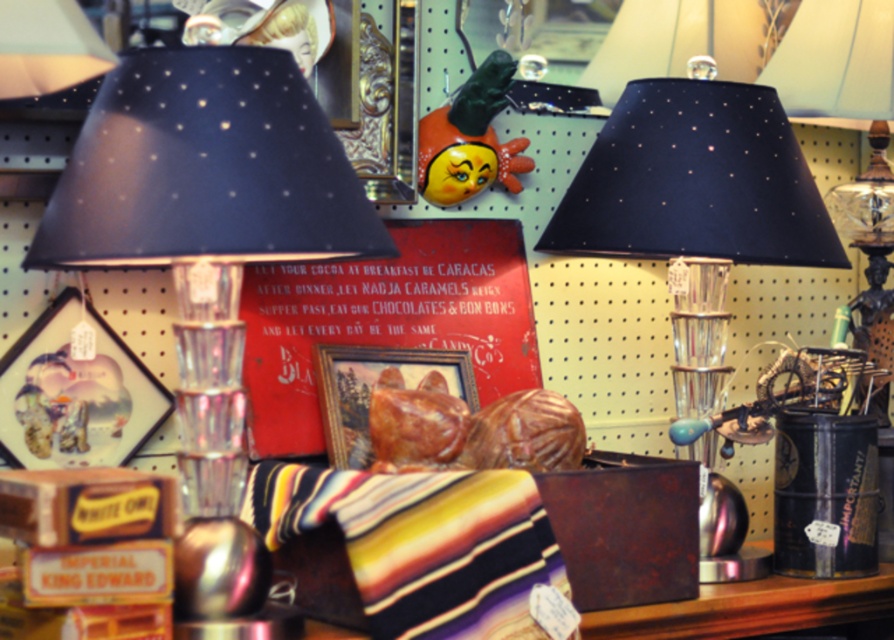
Question: Which point is farther to the camera?

Choices:
 (A) matte black lampshade at upper center
 (B) matte black lampshade at center
 (C) red cardboard sign at center

Answer: (A)

Question: Which object appears farthest from the camera in this image?

Choices:
 (A) matte glass lamp at left
 (B) matte black lampshade at upper center

Answer: (B)

Question: Is red cardboard sign at center to the right of matte black lampshade at upper center from the viewer's perspective?

Choices:
 (A) no
 (B) yes

Answer: (A)

Question: Which of the following is the closest to the observer?

Choices:
 (A) red cardboard sign at center
 (B) matte glass lamp at left
 (C) matte black lampshade at upper center
 (D) matte black lampshade at center

Answer: (B)

Question: Observing the image, what is the correct spatial positioning of matte glass lamp at left in reference to red cardboard sign at center?

Choices:
 (A) left
 (B) right

Answer: (A)

Question: Does red cardboard sign at center have a smaller size compared to matte black lampshade at upper center?

Choices:
 (A) no
 (B) yes

Answer: (A)